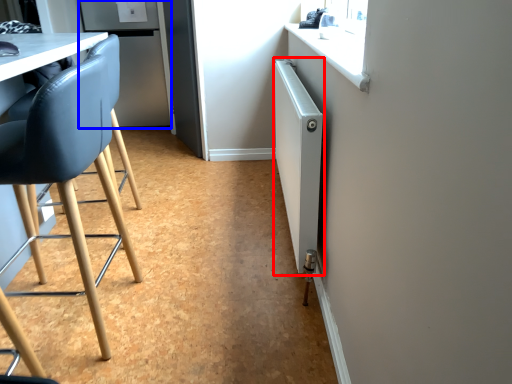
Question: Which object appears farthest to the camera in this image, radiator (highlighted by a red box) or fridge (highlighted by a blue box)?

Choices:
 (A) radiator
 (B) fridge

Answer: (B)